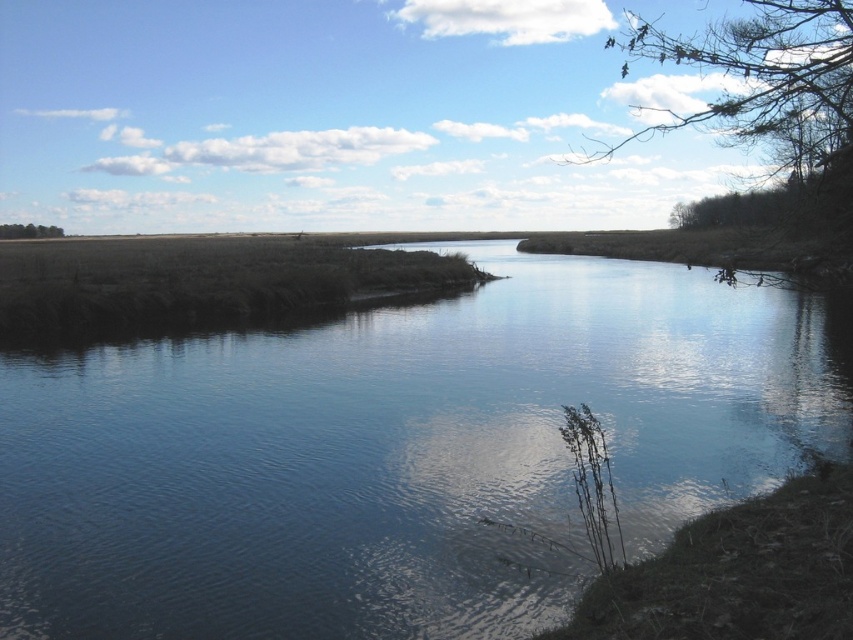
Can you confirm if clear water at center is taller than bare branches at upper right?

No.

Can you confirm if clear water at center is smaller than bare branches at upper right?

Yes.

Between point (42, 422) and point (705, 36), which one is positioned in front?

Point (42, 422) is more forward.

Where is `clear water at center`? clear water at center is located at coordinates (397, 452).

Does bare branches at upper right have a lesser height compared to green leafy tree at left?

In fact, bare branches at upper right may be taller than green leafy tree at left.

Does bare branches at upper right appear on the left side of green leafy tree at left?

Incorrect, bare branches at upper right is not on the left side of green leafy tree at left.

Is point (709, 42) farther from camera compared to point (44, 230)?

That is False.

Find the location of a particular element. bare branches at upper right is located at coordinates (772, 106).

Does clear water at center have a larger size compared to green leafy tree at left?

No, clear water at center is not bigger than green leafy tree at left.

Is clear water at center in front of green leafy tree at left?

That is True.

Who is more forward, (653, 353) or (33, 228)?

Positioned in front is point (653, 353).

This screenshot has height=640, width=853. What are the coordinates of `clear water at center` in the screenshot? It's located at (397, 452).